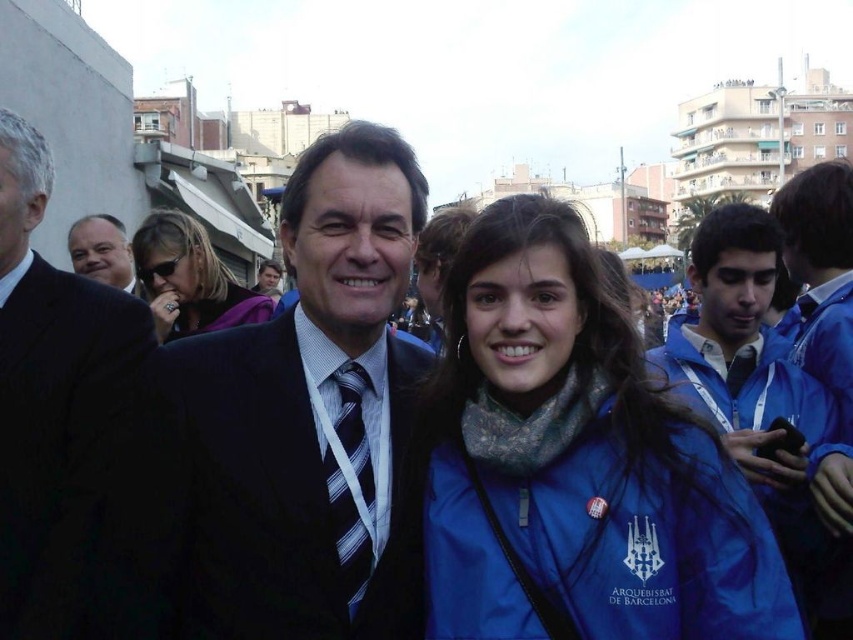
Identify the location of blue fabric jacket at center. (576, 465).

Which is more to the left, blue fabric jacket at center or striped fabric tie at center?

From the viewer's perspective, striped fabric tie at center appears more on the left side.

Which is in front, point (657, 579) or point (337, 387)?

Point (657, 579) is in front.

Find the location of a particular element. This screenshot has width=853, height=640. blue fabric jacket at center is located at coordinates (576, 465).

Between black suit at center and black suit at left, which one is positioned lower?

black suit at center is below.

Identify the location of black suit at center. The width and height of the screenshot is (853, 640). tap(312, 417).

Is point (402, 426) in front of point (3, 224)?

No, it is behind (3, 224).

The width and height of the screenshot is (853, 640). I want to click on black suit at center, so click(x=312, y=417).

Can you confirm if black suit at left is thinner than striped fabric tie at center?

In fact, black suit at left might be wider than striped fabric tie at center.

Looking at this image, who is more distant from viewer, (x=20, y=604) or (x=347, y=432)?

Point (x=347, y=432)

Describe the element at coordinates (71, 433) in the screenshot. I see `black suit at left` at that location.

This screenshot has height=640, width=853. I want to click on black suit at left, so click(71, 433).